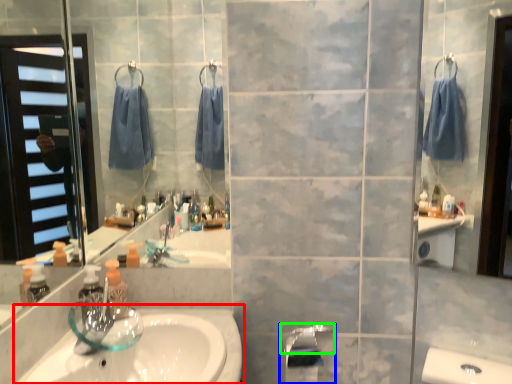
Question: Considering the real-world distances, which object is farthest from sink (highlighted by a red box)? tap (highlighted by a blue box) or faucet (highlighted by a green box)?

Choices:
 (A) tap
 (B) faucet

Answer: (B)